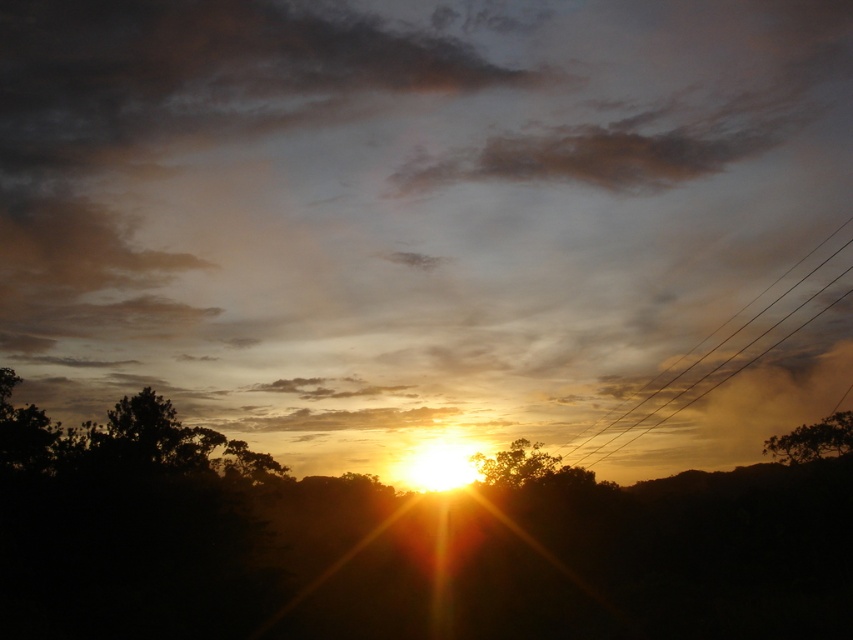
You are standing at the center of the scene and see the point labeled as point (813, 440). Based on the coordinates, can you tell me what object this point is located on?

The point (813, 440) is located on the brown rough tree at right.

You are a drone operator trying to capture the sunset scene. Your drone has a maximum flight range of 70 meters. If you are currently above the matte orange cloud at center, can you safely fly your drone to the silhouette leafy tree at center without exceeding its range?

The distance between the matte orange cloud at center and the silhouette leafy tree at center is 69.93 meters, which is within the drone operator maximum flight range of 70 meters. Yes, the drone can safely fly to the silhouette leafy tree at center without exceeding its range.

You are an ornithologist observing a sunset scene. You notice a point at coordinates point (x=728, y=353). Based on the scene description, can you determine if this point is part of the metallic wire at right or the silhouetted trees in the foreground?

The point (x=728, y=353) is on the metallic wire at right, so it is part of the metallic wire at right and not the silhouetted trees in the foreground.